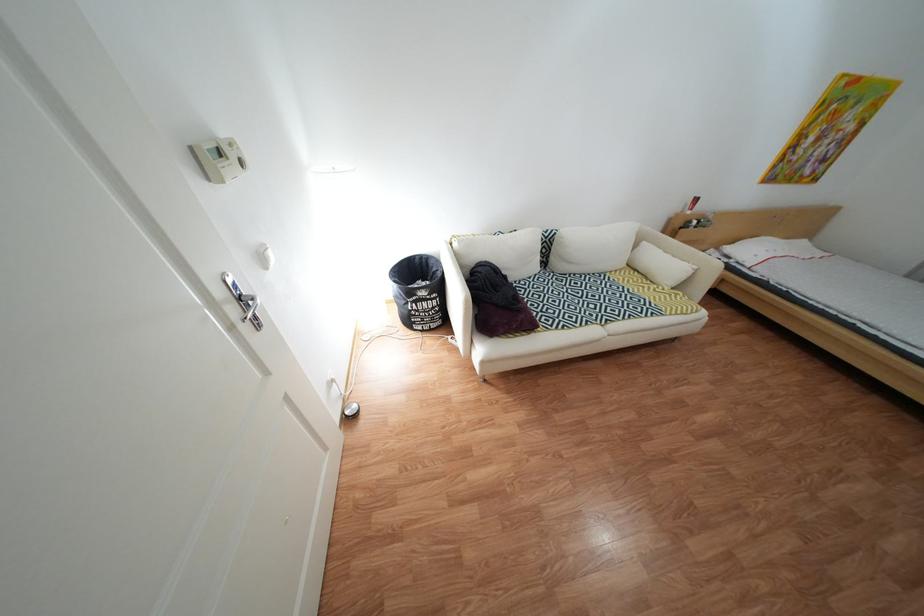
This screenshot has width=924, height=616. What do you see at coordinates (242, 301) in the screenshot? I see `the metal door handle` at bounding box center [242, 301].